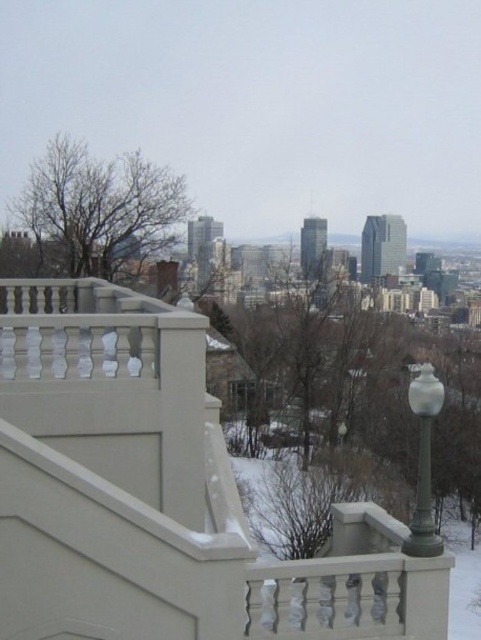
Question: Is the position of white textured balcony at center more distant than that of white glass lamp post at right?

Choices:
 (A) yes
 (B) no

Answer: (A)

Question: Which object is farther from the camera taking this photo?

Choices:
 (A) white textured balcony at center
 (B) white glass lamp post at right

Answer: (A)

Question: Is white textured balcony at center to the right of white glass lamp post at right from the viewer's perspective?

Choices:
 (A) no
 (B) yes

Answer: (A)

Question: From the image, what is the correct spatial relationship of white textured balcony at center in relation to white glass lamp post at right?

Choices:
 (A) above
 (B) below

Answer: (A)

Question: Which object appears farthest from the camera in this image?

Choices:
 (A) white textured balcony at center
 (B) white glass lamp post at right

Answer: (A)